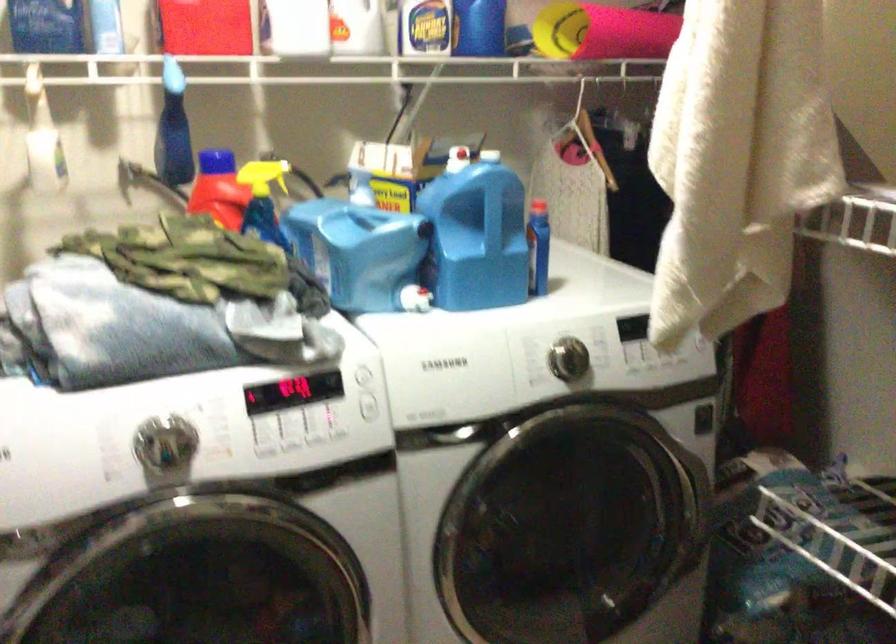
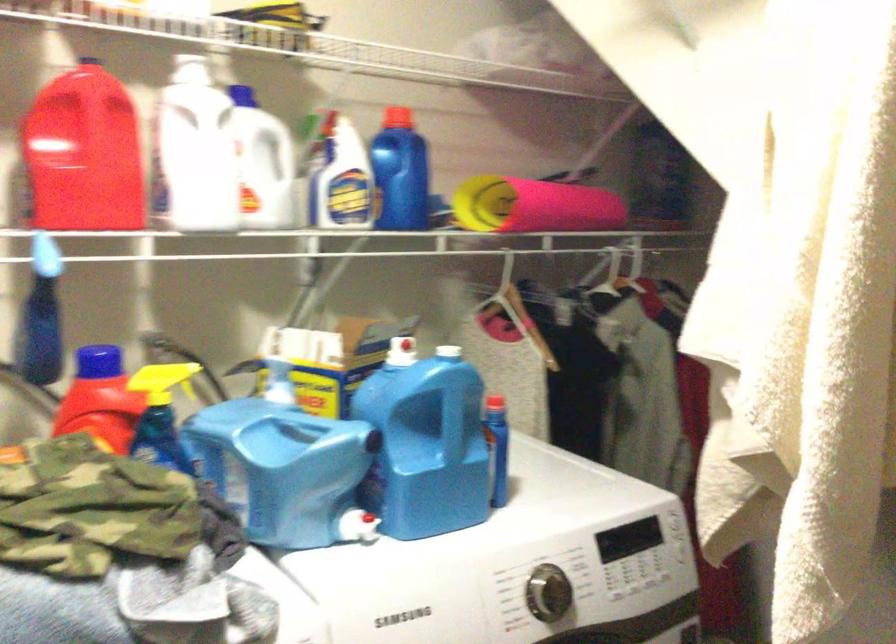
Question: Based on the continuous images, in which direction is the camera rotating? Reply with the corresponding letter.

Choices:
 (A) Left
 (B) Right
 (C) Up
 (D) Down

Answer: (B)